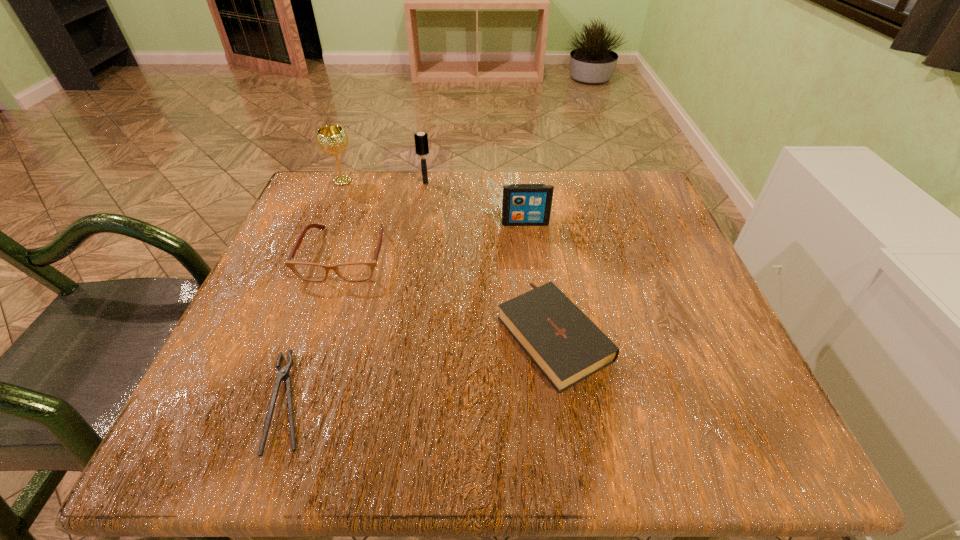
The image size is (960, 540). What are the coordinates of `tongs that is at the left edge` in the screenshot? It's located at click(x=283, y=374).

Where is `chalice situated at the far left corner`? The width and height of the screenshot is (960, 540). chalice situated at the far left corner is located at coordinates (331, 139).

What are the coordinates of `spectacles that is at the far left corner` in the screenshot? It's located at (354, 271).

The height and width of the screenshot is (540, 960). In order to click on object that is positioned at the near left corner in this screenshot , I will do `click(283, 374)`.

Identify the location of free spot at the far edge of the desktop. (384, 220).

The height and width of the screenshot is (540, 960). I want to click on free region at the near edge of the desktop, so click(x=328, y=420).

Find the location of `vacant region at the left edge of the desktop`. vacant region at the left edge of the desktop is located at coordinates (228, 356).

Locate an element on the screen. free space at the right edge is located at coordinates (658, 345).

In the image, there is a desktop. At what (x,y) coordinates should I click in order to perform the action: click on vacant area at the far left corner. Please return your answer as a coordinate pair (x, y). Looking at the image, I should click on (349, 215).

In the image, there is a desktop. Where is `vacant space at the far right corner`? vacant space at the far right corner is located at coordinates (596, 175).